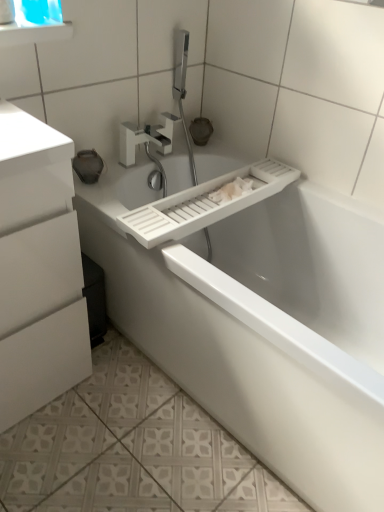
Identify the location of white matte tap at upper center. (147, 137).

Describe the element at coordinates (38, 268) in the screenshot. I see `white glossy cabinet at left` at that location.

Locate an element on the screen. transparent plastic medicine cabinet at upper left is located at coordinates (34, 22).

What are the coordinates of `white plastic sink at upper center` in the screenshot? It's located at (192, 181).

How different are the orientations of white plastic sink at upper center and transparent plastic medicine cabinet at upper left in degrees?

The facing directions of white plastic sink at upper center and transparent plastic medicine cabinet at upper left are 0.946 degrees apart.

Could transparent plastic medicine cabinet at upper left be considered to be inside white plastic sink at upper center?

No, transparent plastic medicine cabinet at upper left is not surrounded by white plastic sink at upper center.

Is white plastic sink at upper center oriented away from transparent plastic medicine cabinet at upper left?

white plastic sink at upper center does not have its back to transparent plastic medicine cabinet at upper left.

Is white plastic sink at upper center wider than transparent plastic medicine cabinet at upper left?

Yes, white plastic sink at upper center is wider than transparent plastic medicine cabinet at upper left.

How much distance is there between white matte tap at upper center and white glossy cabinet at left?

white matte tap at upper center is 62.57 centimeters away from white glossy cabinet at left.

Is white matte tap at upper center with white glossy cabinet at left?

No, white matte tap at upper center is not making contact with white glossy cabinet at left.

Does point (158, 141) appear closer or farther from the camera than point (31, 170)?

Point (158, 141).

From the picture: What's the angular difference between white matte tap at upper center and white glossy cabinet at left's facing directions?

There is a 1.05-degree angle between the facing directions of white matte tap at upper center and white glossy cabinet at left.

Looking at this image, which object is thinner, transparent plastic medicine cabinet at upper left or white plastic bathtub at center?

With smaller width is transparent plastic medicine cabinet at upper left.

Is point (24, 10) closer or farther from the camera than point (138, 269)?

Point (24, 10) is closer to the camera than point (138, 269).

In the scene shown: Is transparent plastic medicine cabinet at upper left positioned far away from white plastic bathtub at center?

transparent plastic medicine cabinet at upper left is actually quite close to white plastic bathtub at center.

How different are the orientations of transparent plastic medicine cabinet at upper left and white plastic bathtub at center in degrees?

The angular difference between transparent plastic medicine cabinet at upper left and white plastic bathtub at center is 89.5 degrees.

Could white matte tap at upper center be considered to be inside white plastic bathtub at center?

That's incorrect, white matte tap at upper center is not inside white plastic bathtub at center.

Would you say white plastic bathtub at center is a long distance from white matte tap at upper center?

No, white plastic bathtub at center is in close proximity to white matte tap at upper center.

Is point (281, 231) positioned after point (138, 126)?

Yes, point (281, 231) is behind point (138, 126).

Can you confirm if white plastic bathtub at center is bigger than white matte tap at upper center?

Yes.

Does white glossy cabinet at left turn towards white matte tap at upper center?

No, white glossy cabinet at left is not facing towards white matte tap at upper center.

Measure the distance between white glossy cabinet at left and white matte tap at upper center.

They are 62.57 centimeters apart.

From the image's perspective, is white glossy cabinet at left over white matte tap at upper center?

No, from the image's perspective, white glossy cabinet at left is not on top of white matte tap at upper center.

How many degrees apart are the facing directions of white glossy cabinet at left and white matte tap at upper center?

1.05 degrees.

In the scene shown: Is white glossy cabinet at left facing towards transparent plastic medicine cabinet at upper left?

No, white glossy cabinet at left is not aimed at transparent plastic medicine cabinet at upper left.

Considering the relative sizes of white glossy cabinet at left and transparent plastic medicine cabinet at upper left in the image provided, is white glossy cabinet at left shorter than transparent plastic medicine cabinet at upper left?

In fact, white glossy cabinet at left may be taller than transparent plastic medicine cabinet at upper left.

Would you say transparent plastic medicine cabinet at upper left is part of white glossy cabinet at left's contents?

A: Actually, transparent plastic medicine cabinet at upper left is outside white glossy cabinet at left.

Which is behind, point (58, 298) or point (14, 24)?

Positioned behind is point (58, 298).

In order to click on window screen above the white plastic bathtub at center (from the image's perspective) in this screenshot , I will do `click(38, 12)`.

From the image's perspective, which one is positioned lower, transparent plastic window screen at upper left or white plastic bathtub at center?

From the image's view, white plastic bathtub at center is below.

From a real-world perspective, between transparent plastic window screen at upper left and white plastic bathtub at center, who is vertically higher?

transparent plastic window screen at upper left, from a real-world perspective.

Looking at this image, is transparent plastic window screen at upper left shorter than white plastic bathtub at center?

Correct, transparent plastic window screen at upper left is not as tall as white plastic bathtub at center.

The width and height of the screenshot is (384, 512). I want to click on medicine cabinet that appears above the white plastic sink at upper center (from the image's perspective), so click(x=34, y=22).

The width and height of the screenshot is (384, 512). What are the coordinates of `bathroom cabinet that appears below the white matte tap at upper center (from the image's perspective)` in the screenshot? It's located at (38, 268).

Considering their positions, is transparent plastic window screen at upper left positioned further to white plastic bathtub at center than white plastic sink at upper center?

transparent plastic window screen at upper left is further to white plastic bathtub at center.

Looking at the image, which one is located closer to white plastic sink at upper center, transparent plastic medicine cabinet at upper left or white glossy cabinet at left?

The object closer to white plastic sink at upper center is white glossy cabinet at left.

When comparing their distances from transparent plastic medicine cabinet at upper left, does white plastic sink at upper center or white plastic bathtub at center seem closer?

The object closer to transparent plastic medicine cabinet at upper left is white plastic sink at upper center.

In the scene shown: Which object lies further to the anchor point white plastic sink at upper center, white plastic bathtub at center or white glossy cabinet at left?

The object further to white plastic sink at upper center is white glossy cabinet at left.

Looking at the image, which one is located closer to transparent plastic medicine cabinet at upper left, white plastic bathtub at center or white matte tap at upper center?

white matte tap at upper center lies closer to transparent plastic medicine cabinet at upper left than the other object.

When comparing their distances from white glossy cabinet at left, does white plastic bathtub at center or transparent plastic window screen at upper left seem closer?

white plastic bathtub at center lies closer to white glossy cabinet at left than the other object.

Consider the image. When comparing their distances from white matte tap at upper center, does white glossy cabinet at left or white plastic bathtub at center seem further?

The object further to white matte tap at upper center is white glossy cabinet at left.

Looking at this image, which object lies further to the anchor point transparent plastic window screen at upper left, white matte tap at upper center or white plastic sink at upper center?

Based on the image, white plastic sink at upper center appears to be further to transparent plastic window screen at upper left.

Locate an element on the screen. medicine cabinet between transparent plastic window screen at upper left and white plastic bathtub at center from top to bottom is located at coordinates (34, 22).

Identify the location of bathroom cabinet between white plastic bathtub at center and white matte tap at upper center along the z-axis. (38, 268).

Identify the location of sink situated between white glossy cabinet at left and white plastic bathtub at center from left to right. The width and height of the screenshot is (384, 512). (192, 181).

What are the coordinates of `sink between transparent plastic medicine cabinet at upper left and white glossy cabinet at left from top to bottom` in the screenshot? It's located at (192, 181).